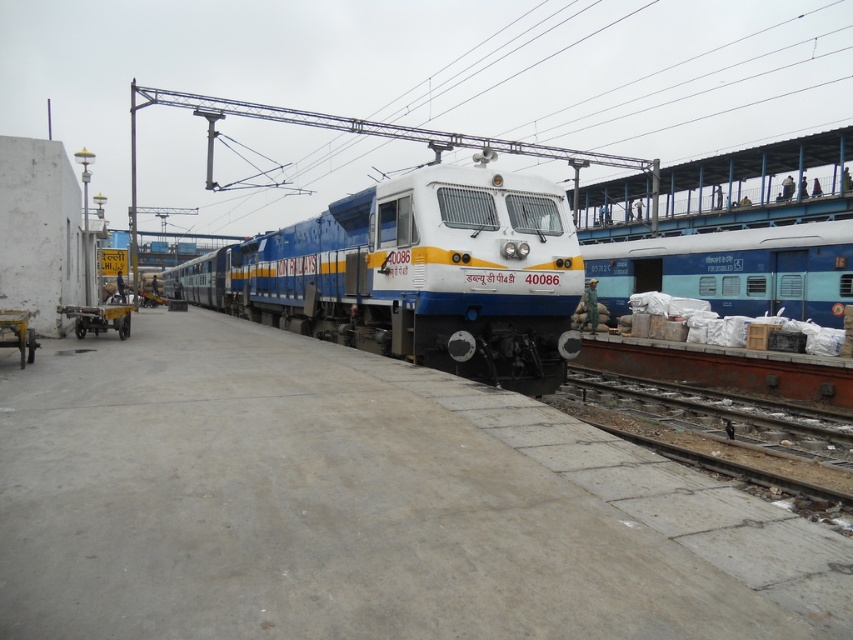
You are a railway engineer assessing the safety of the tracks. You notice the rusty metal track at lower right and the blue matte train at right. Which object is wider according to the scene?

The rusty metal track at lower right might be wider than blue matte train at right.

Based on the photo, you are a maintenance worker at the railway station. You need to move a 15 meter long equipment truck from the metallic silver cart at left to the blue matte train at right. Is there enough space between them to maneuver the truck?

The blue matte train at right and metallic silver cart at left are 17.55 meters apart, so yes, the equipment truck of 15 meters can be maneuvered between them as there is sufficient space.